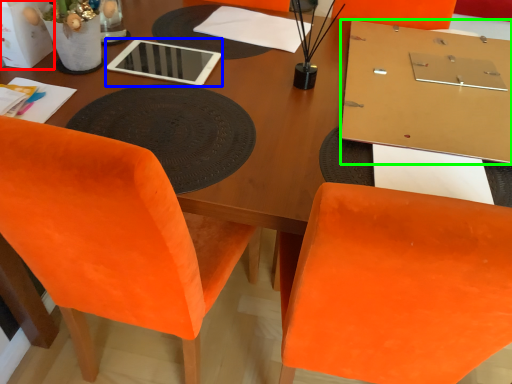
Question: Estimate the real-world distances between objects in this image. Which object is closer to box (highlighted by a red box), tablet computer (highlighted by a blue box) or table (highlighted by a green box)?

Choices:
 (A) tablet computer
 (B) table

Answer: (A)